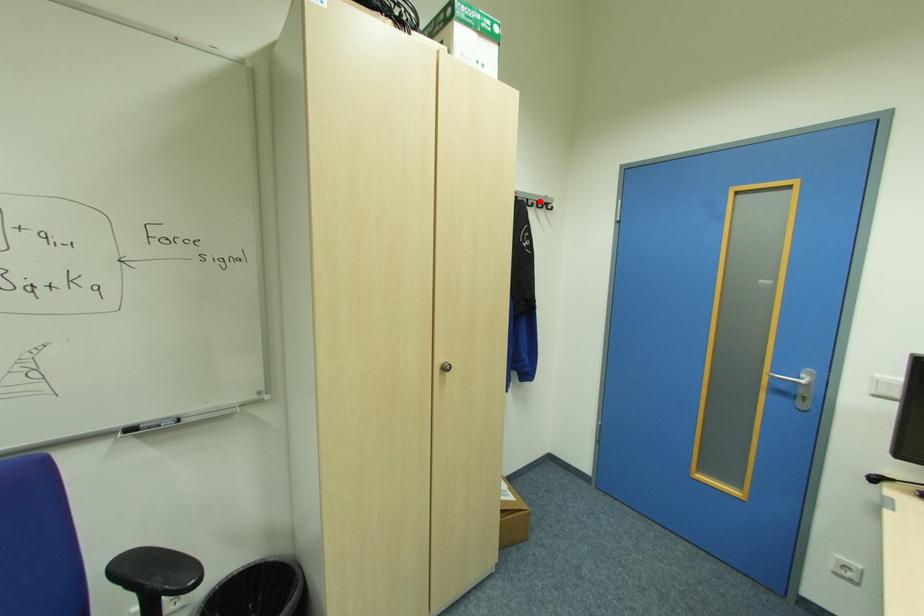
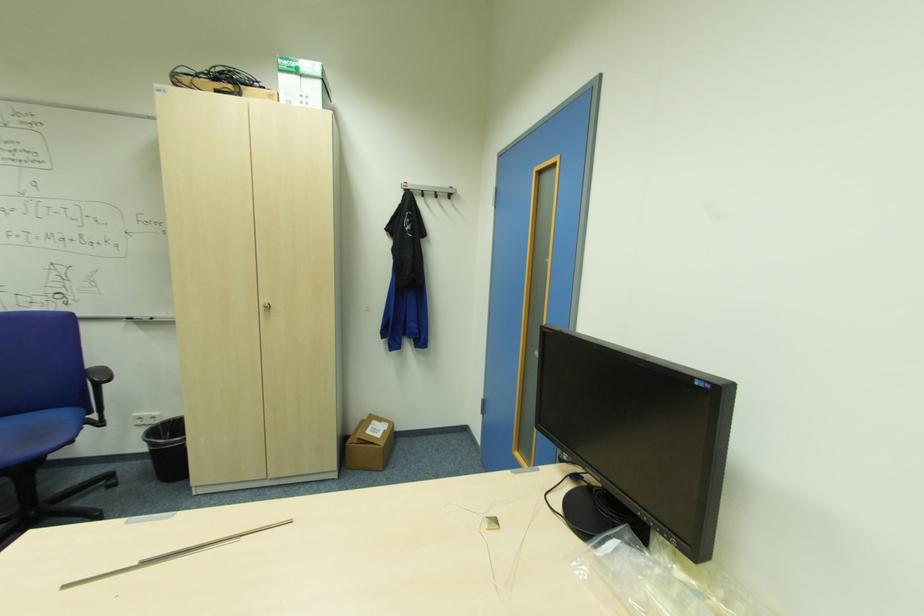
The point at the highlighted location is marked in the first image. Where is the corresponding point in the second image?

(439, 192)